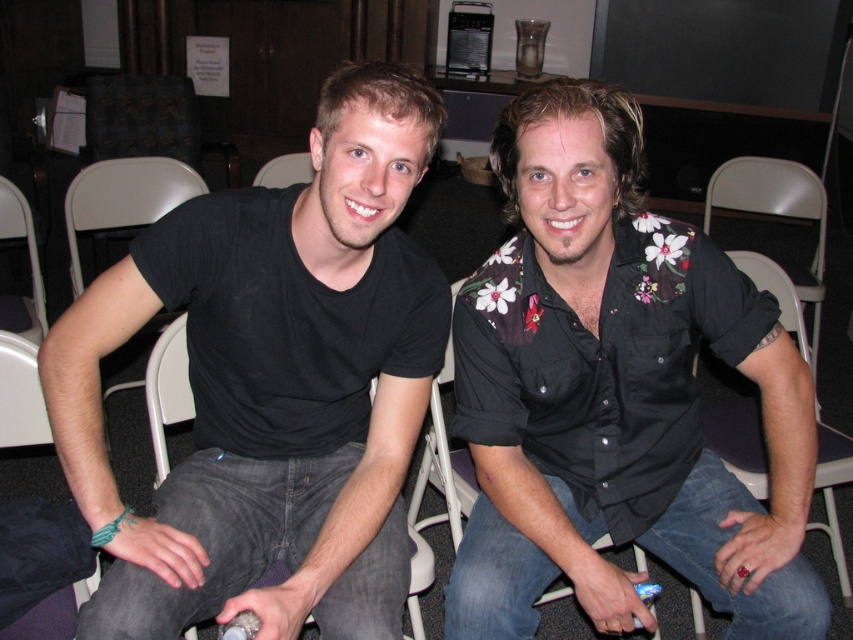
Question: Does black matte t-shirt at center appear over white plastic chair at lower right?

Choices:
 (A) yes
 (B) no

Answer: (A)

Question: Estimate the real-world distances between objects in this image. Which object is farther from the gray fabric chair at left?

Choices:
 (A) white plastic chair at lower right
 (B) floral-patterned shirt at center
 (C) black matte t-shirt at center
 (D) white plastic chair at left

Answer: (A)

Question: Which point is farther to the camera?

Choices:
 (A) white plastic chair at left
 (B) floral-patterned shirt at center
 (C) gray fabric chair at left

Answer: (A)

Question: Is floral-patterned shirt at center behind white plastic chair at left?

Choices:
 (A) no
 (B) yes

Answer: (A)

Question: Based on their relative distances, which object is nearer to the floral-patterned shirt at center?

Choices:
 (A) gray fabric chair at left
 (B) white plastic chair at left

Answer: (A)

Question: Does black matte t-shirt at center have a greater width compared to gray fabric chair at left?

Choices:
 (A) yes
 (B) no

Answer: (A)